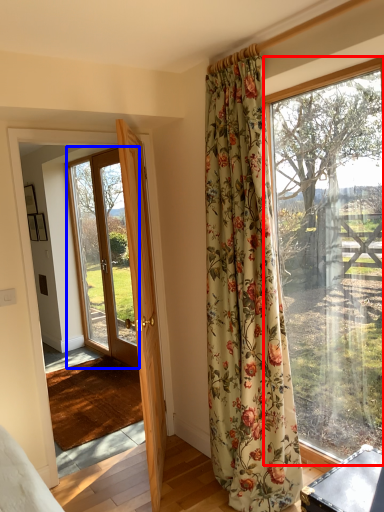
Question: Which point is further to the camera, window (highlighted by a red box) or glass door (highlighted by a blue box)?

Choices:
 (A) window
 (B) glass door

Answer: (B)